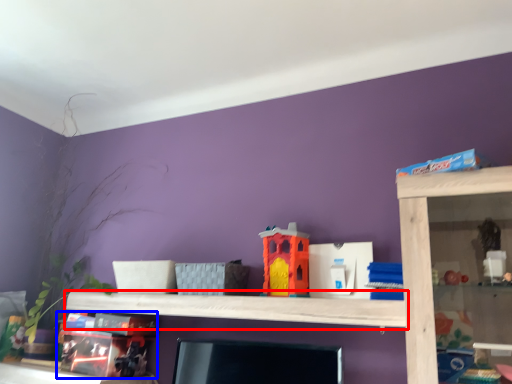
Question: Which of the following is the farthest to the observer, shelf (highlighted by a red box) or toy (highlighted by a blue box)?

Choices:
 (A) shelf
 (B) toy

Answer: (B)